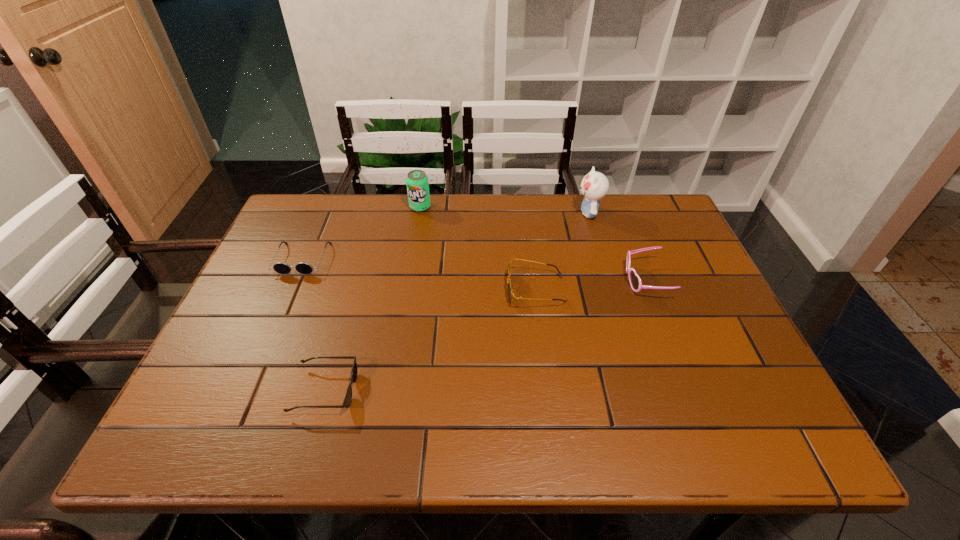
Find the location of a particular element. The height and width of the screenshot is (540, 960). free space located 0.340m on the front lenses of the second object from left to right is located at coordinates (520, 390).

This screenshot has height=540, width=960. I want to click on kitten located in the far edge section of the desktop, so click(594, 186).

Locate an element on the screen. The width and height of the screenshot is (960, 540). pop soda that is positioned at the far edge is located at coordinates (417, 183).

Image resolution: width=960 pixels, height=540 pixels. Identify the location of object that is at the near edge. (347, 401).

Where is `object at the left edge`? The image size is (960, 540). object at the left edge is located at coordinates (280, 267).

You are a GUI agent. You are given a task and a screenshot of the screen. Output one action in this format:
    pyautogui.click(x=<x>, y=<y>)
    Task: Click on the object present at the right edge
    The image size is (960, 540).
    Given the screenshot: What is the action you would take?
    pyautogui.click(x=635, y=281)

The width and height of the screenshot is (960, 540). In the image, there is a desktop. Identify the location of vacant space at the far edge. (436, 195).

What are the coordinates of `vacant space at the left edge of the desktop` in the screenshot? It's located at (243, 306).

The image size is (960, 540). In the image, there is a desktop. In order to click on vacant space at the far left corner in this screenshot , I will do `click(303, 229)`.

In the image, there is a desktop. Where is `free space at the far right corner`? This screenshot has height=540, width=960. free space at the far right corner is located at coordinates (652, 195).